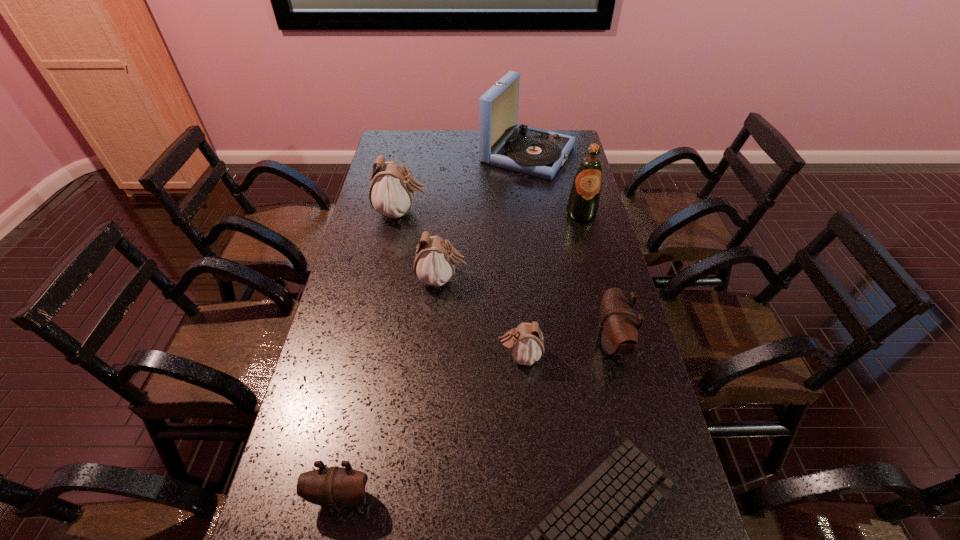
I want to click on vacant space positioned on the front-facing side of the nearest white pouch, so click(355, 356).

Locate an element on the screen. The width and height of the screenshot is (960, 540). vacant space positioned on the front-facing side of the nearest white pouch is located at coordinates (432, 356).

In order to click on vacant region located on the front-facing side of the nearest white pouch in this screenshot , I will do `click(366, 356)`.

You are a GUI agent. You are given a task and a screenshot of the screen. Output one action in this format:
    pyautogui.click(x=<x>, y=<y>)
    Task: Click on the object present at the far edge
    The image size is (960, 540).
    Given the screenshot: What is the action you would take?
    pyautogui.click(x=502, y=142)

The width and height of the screenshot is (960, 540). In order to click on phonograph record present at the right edge in this screenshot , I will do `click(502, 142)`.

Identify the location of olive oil at the right edge. The image size is (960, 540). (583, 203).

Image resolution: width=960 pixels, height=540 pixels. I want to click on pouch situated at the right edge, so click(x=618, y=331).

The width and height of the screenshot is (960, 540). I want to click on object that is at the far right corner, so click(502, 142).

This screenshot has width=960, height=540. In order to click on vacant space at the far edge in this screenshot , I will do `click(431, 133)`.

Image resolution: width=960 pixels, height=540 pixels. Identify the location of free space at the left edge of the desktop. (324, 342).